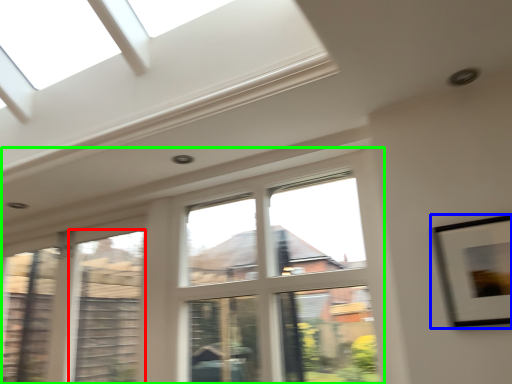
Question: Which object is positioned closest to window (highlighted by a red box)? Select from picture frame (highlighted by a blue box) and window (highlighted by a green box).

Choices:
 (A) picture frame
 (B) window

Answer: (B)